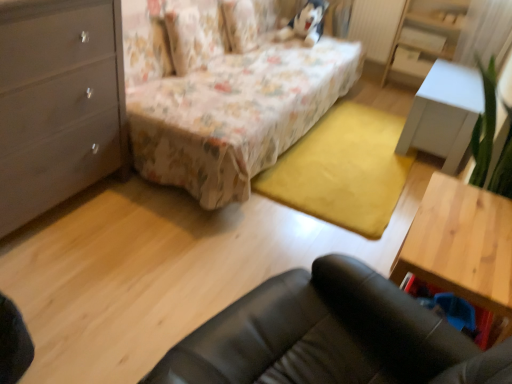
Question: From a real-world perspective, is wooden table at lower right, which is the 1th table in bottom-to-top order, located higher than floral fabric pillow at upper center?

Choices:
 (A) no
 (B) yes

Answer: (A)

Question: Does wooden table at lower right, positioned as the first table in front-to-back order, touch floral fabric pillow at upper center?

Choices:
 (A) yes
 (B) no

Answer: (B)

Question: Is wooden table at lower right, the 2th table from the right, not near floral fabric pillow at upper center?

Choices:
 (A) yes
 (B) no

Answer: (A)

Question: Is wooden table at lower right, the 1th table positioned from the left, at the right side of floral fabric pillow at upper center?

Choices:
 (A) no
 (B) yes

Answer: (B)

Question: Can you confirm if wooden table at lower right, the second table viewed from the top, is thinner than floral fabric pillow at upper center?

Choices:
 (A) yes
 (B) no

Answer: (B)

Question: From the image's perspective, is wooden table at lower right, the 2th table from the right, beneath floral fabric pillow at upper center?

Choices:
 (A) yes
 (B) no

Answer: (A)

Question: Is matte gray dresser at left located within white matte drawer at upper right?

Choices:
 (A) yes
 (B) no

Answer: (B)

Question: Considering the relative sizes of white matte drawer at upper right and matte gray dresser at left in the image provided, is white matte drawer at upper right bigger than matte gray dresser at left?

Choices:
 (A) yes
 (B) no

Answer: (B)

Question: Can you confirm if white matte drawer at upper right is taller than matte gray dresser at left?

Choices:
 (A) no
 (B) yes

Answer: (A)

Question: Does white matte drawer at upper right have a smaller size compared to matte gray dresser at left?

Choices:
 (A) no
 (B) yes

Answer: (B)

Question: From the image's perspective, is white matte drawer at upper right over matte gray dresser at left?

Choices:
 (A) no
 (B) yes

Answer: (B)

Question: Are white matte drawer at upper right and matte gray dresser at left located far from each other?

Choices:
 (A) yes
 (B) no

Answer: (A)

Question: From the image's perspective, does wooden table at lower right, which is the 1th table in bottom-to-top order, appear higher than floral fabric bed at center?

Choices:
 (A) yes
 (B) no

Answer: (B)